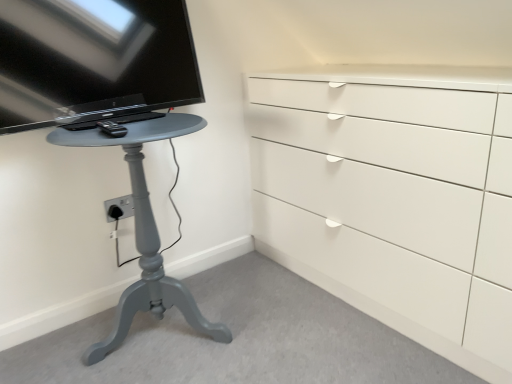
Question: Considering the relative sizes of matte gray table at left and black glossy tv at upper left in the image provided, is matte gray table at left thinner than black glossy tv at upper left?

Choices:
 (A) yes
 (B) no

Answer: (B)

Question: Can you confirm if matte gray table at left is wider than black glossy tv at upper left?

Choices:
 (A) yes
 (B) no

Answer: (A)

Question: Is matte gray table at left facing towards black glossy tv at upper left?

Choices:
 (A) yes
 (B) no

Answer: (B)

Question: Does matte gray table at left have a greater height compared to black glossy tv at upper left?

Choices:
 (A) yes
 (B) no

Answer: (A)

Question: Are matte gray table at left and black glossy tv at upper left beside each other?

Choices:
 (A) no
 (B) yes

Answer: (A)

Question: Which is correct: black plastic remote control at left is inside matte gray table at left, or outside of it?

Choices:
 (A) outside
 (B) inside

Answer: (A)

Question: Is black plastic remote control at left bigger or smaller than matte gray table at left?

Choices:
 (A) big
 (B) small

Answer: (B)

Question: From a real-world perspective, relative to matte gray table at left, is black plastic remote control at left vertically above or below?

Choices:
 (A) above
 (B) below

Answer: (A)

Question: Considering their positions, is black plastic remote control at left located in front of or behind matte gray table at left?

Choices:
 (A) behind
 (B) front

Answer: (A)

Question: In terms of width, does black plastic remote control at left look wider or thinner when compared to black glossy tv at upper left?

Choices:
 (A) thin
 (B) wide

Answer: (A)

Question: Based on their positions, is black plastic remote control at left located to the left or right of black glossy tv at upper left?

Choices:
 (A) left
 (B) right

Answer: (B)

Question: Based on their sizes in the image, would you say black plastic remote control at left is bigger or smaller than black glossy tv at upper left?

Choices:
 (A) big
 (B) small

Answer: (B)

Question: Is black plastic remote control at left in front of or behind black glossy tv at upper left in the image?

Choices:
 (A) front
 (B) behind

Answer: (B)

Question: From the image's perspective, is black glossy tv at upper left above or below black plastic remote control at left?

Choices:
 (A) above
 (B) below

Answer: (A)

Question: Choose the correct answer: Is black glossy tv at upper left inside black plastic remote control at left or outside it?

Choices:
 (A) inside
 (B) outside

Answer: (B)